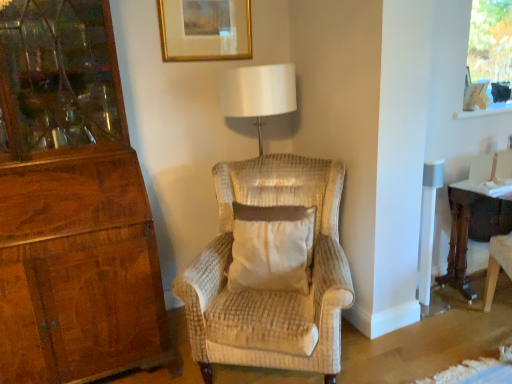
Question: Is transparent glass window screen at upper right not within dark brown wood desk at right?

Choices:
 (A) no
 (B) yes

Answer: (B)

Question: Is transparent glass window screen at upper right further to camera compared to dark brown wood desk at right?

Choices:
 (A) yes
 (B) no

Answer: (A)

Question: Does transparent glass window screen at upper right have a smaller size compared to dark brown wood desk at right?

Choices:
 (A) no
 (B) yes

Answer: (B)

Question: Does transparent glass window screen at upper right have a greater width compared to dark brown wood desk at right?

Choices:
 (A) no
 (B) yes

Answer: (A)

Question: Considering the relative sizes of transparent glass window screen at upper right and dark brown wood desk at right in the image provided, is transparent glass window screen at upper right bigger than dark brown wood desk at right?

Choices:
 (A) yes
 (B) no

Answer: (B)

Question: Can you confirm if transparent glass window screen at upper right is positioned to the right of dark brown wood desk at right?

Choices:
 (A) yes
 (B) no

Answer: (A)

Question: Considering the relative sizes of gold-framed picture at upper center and dark brown wood desk at right in the image provided, is gold-framed picture at upper center taller than dark brown wood desk at right?

Choices:
 (A) no
 (B) yes

Answer: (A)

Question: Does gold-framed picture at upper center lie in front of dark brown wood desk at right?

Choices:
 (A) yes
 (B) no

Answer: (B)

Question: Can dark brown wood desk at right be found inside gold-framed picture at upper center?

Choices:
 (A) no
 (B) yes

Answer: (A)

Question: Can you confirm if gold-framed picture at upper center is smaller than dark brown wood desk at right?

Choices:
 (A) yes
 (B) no

Answer: (A)

Question: Can you confirm if gold-framed picture at upper center is wider than dark brown wood desk at right?

Choices:
 (A) no
 (B) yes

Answer: (A)

Question: From the image's perspective, is gold-framed picture at upper center beneath dark brown wood desk at right?

Choices:
 (A) no
 (B) yes

Answer: (A)

Question: From a real-world perspective, is transparent glass window screen at upper right physically below white textured pillow at center?

Choices:
 (A) no
 (B) yes

Answer: (A)